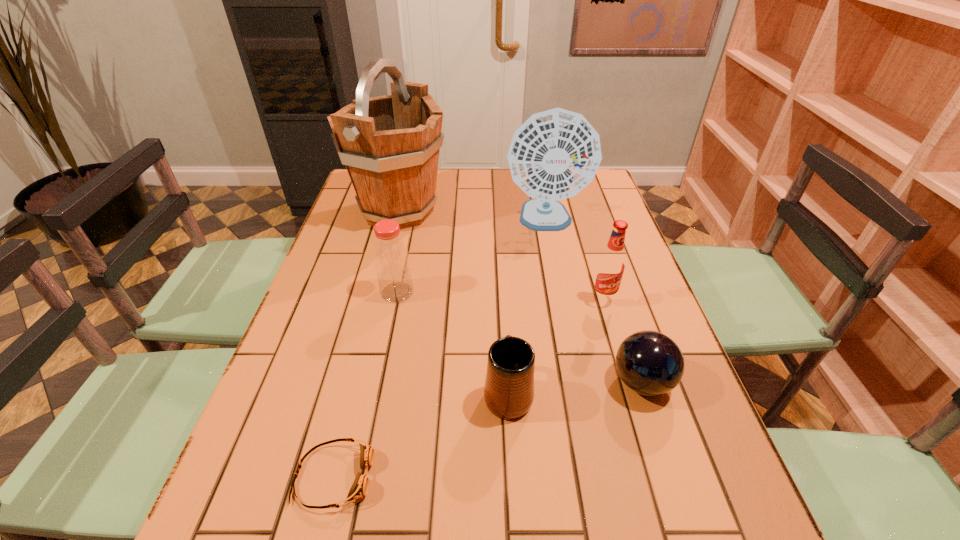
Locate an element on the screen. The width and height of the screenshot is (960, 540). the tallest object is located at coordinates (390, 144).

Locate an element on the screen. fan is located at coordinates (554, 154).

This screenshot has width=960, height=540. I want to click on root beer, so click(x=611, y=264).

Image resolution: width=960 pixels, height=540 pixels. What are the coordinates of `bottle` in the screenshot? It's located at (392, 264).

What are the coordinates of `mug` in the screenshot? It's located at (509, 385).

Locate an element on the screen. This screenshot has height=540, width=960. bowling ball is located at coordinates (650, 363).

This screenshot has width=960, height=540. What are the coordinates of `the nearest object` in the screenshot? It's located at (359, 489).

Identify the location of goggles. (359, 489).

This screenshot has height=540, width=960. Find the location of `vacant space located on the front of the bucket`. vacant space located on the front of the bucket is located at coordinates (367, 332).

Identify the location of vacant point located on the grille of the fan. The image size is (960, 540). (561, 295).